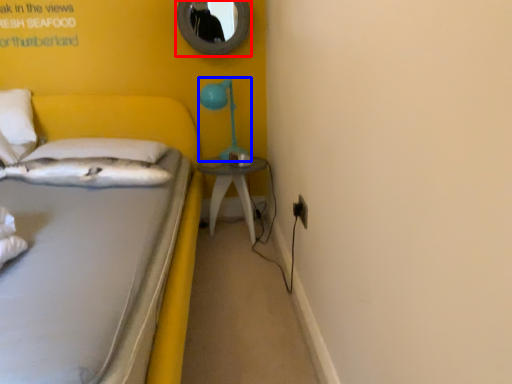
Question: Which of the following is the farthest to the observer, mirror (highlighted by a red box) or table lamp (highlighted by a blue box)?

Choices:
 (A) mirror
 (B) table lamp

Answer: (A)